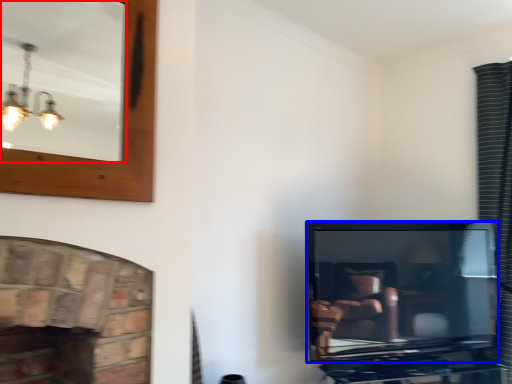
Question: Which point is further to the camera, mirror (highlighted by a red box) or television (highlighted by a blue box)?

Choices:
 (A) mirror
 (B) television

Answer: (B)